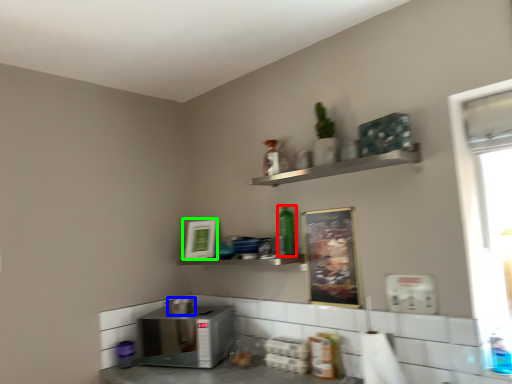
Question: Which object is positioned closest to bottle (highlighted by a red box)? Select from appliance (highlighted by a blue box) and picture frame (highlighted by a green box).

Choices:
 (A) appliance
 (B) picture frame

Answer: (B)